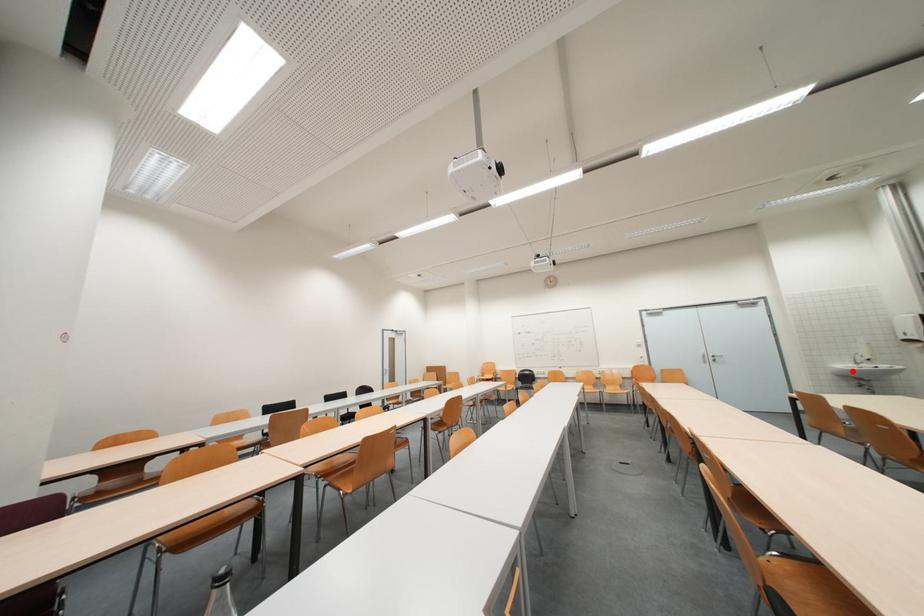
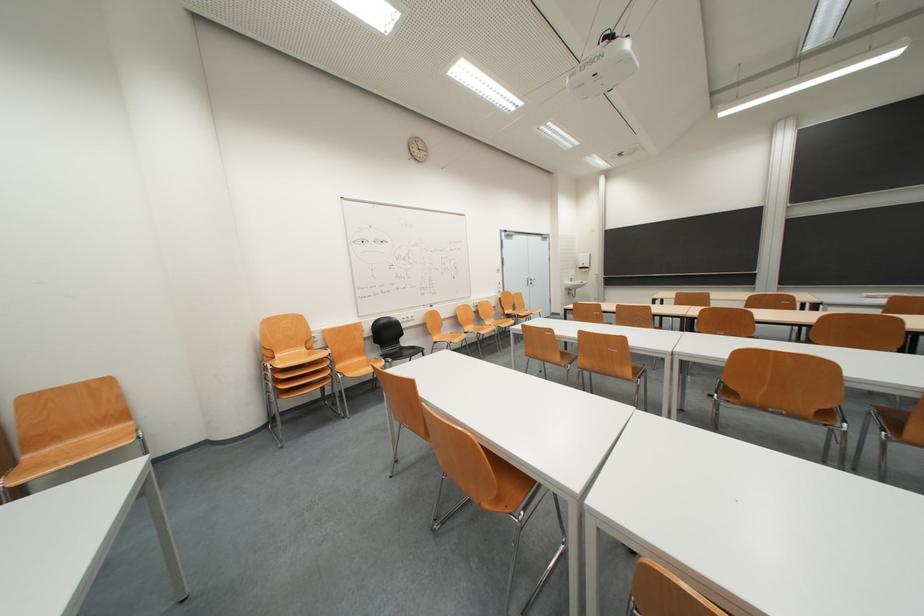
Question: I am providing you with two images of the same scene from different viewpoints. Given a red point in image1, look at the same physical point in image2. Is it:

Choices:
 (A) Closer to the viewpoint
 (B) Farther from the viewpoint

Answer: (B)